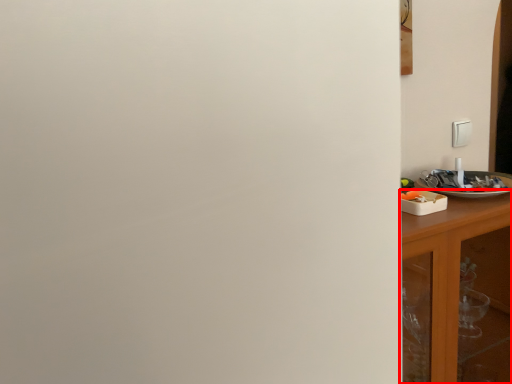
Question: In this image, where is cabinetry (annotated by the red box) located relative to tableware?

Choices:
 (A) left
 (B) right

Answer: (A)